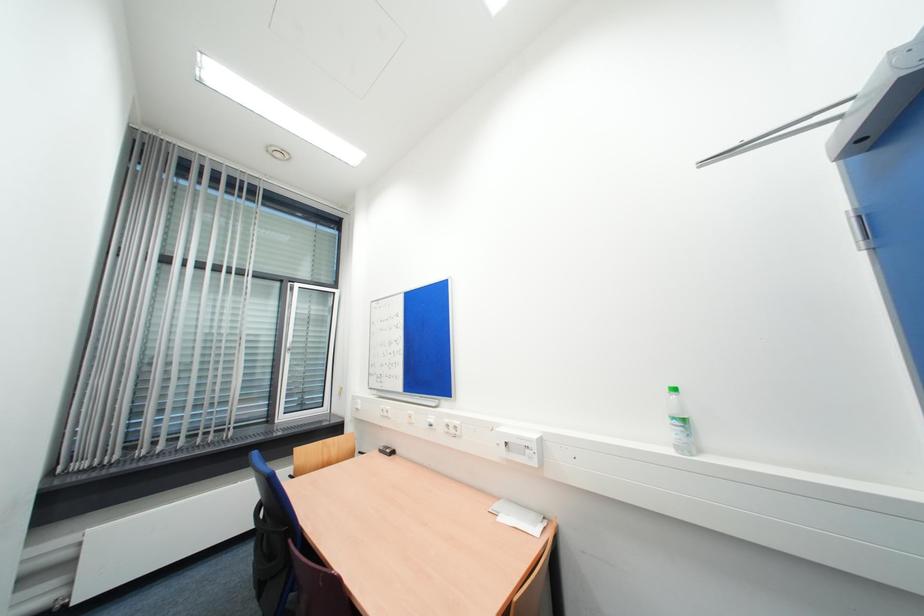
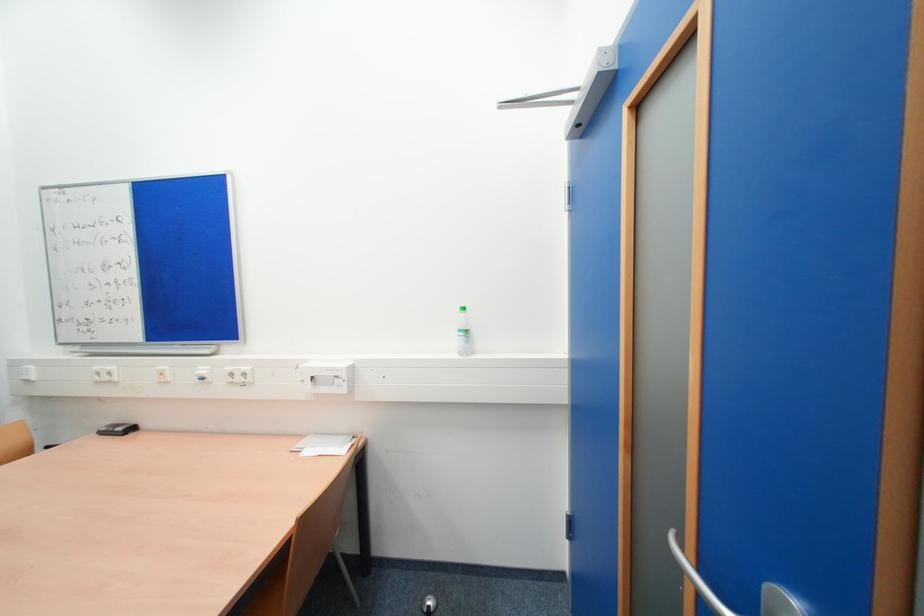
Question: The images are taken continuously from a first-person perspective. In which direction is your viewpoint rotating?

Choices:
 (A) Left
 (B) Right
 (C) Up
 (D) Down

Answer: (B)